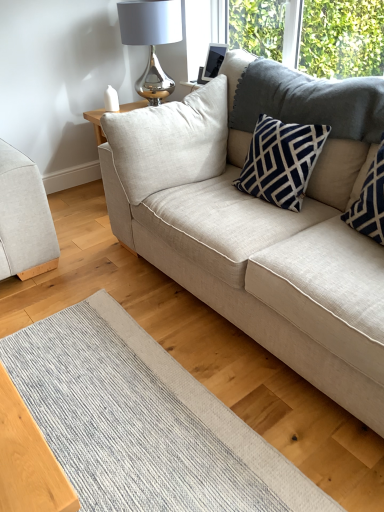
Identify the location of textured gray mat at lower center. The width and height of the screenshot is (384, 512). (143, 422).

At what (x,y) coordinates should I click in order to perform the action: click on navy blue textured pillow at upper right, placed as the 1th pillow when sorted from right to left. Please return your answer as a coordinate pair (x, y). The width and height of the screenshot is (384, 512). Looking at the image, I should click on (370, 201).

Locate an element on the screen. Image resolution: width=384 pixels, height=512 pixels. textured gray mat at lower center is located at coordinates (143, 422).

From the image's perspective, which is above, beige fabric couch at center, which is the 1th studio couch from right to left, or navy blue textured pillow at upper right, placed as the 1th pillow when sorted from right to left?

beige fabric couch at center, which is the 1th studio couch from right to left, appears higher in the image.

Is navy blue textured pillow at upper right, placed as the 1th pillow when sorted from right to left, at the back of beige fabric couch at center, acting as the 2th studio couch starting from the left?

Yes, beige fabric couch at center, acting as the 2th studio couch starting from the left,'s orientation is away from navy blue textured pillow at upper right, placed as the 1th pillow when sorted from right to left.

Consider the image. Which of these two, beige fabric couch at center, acting as the 2th studio couch starting from the left, or navy blue textured pillow at upper right, placed as the 1th pillow when sorted from right to left, is bigger?

beige fabric couch at center, acting as the 2th studio couch starting from the left.

How different are the orientations of beige fabric couch at center, which is the 1th studio couch from right to left, and navy blue textured pillow at upper right, placed as the 1th pillow when sorted from right to left, in degrees?

The facing directions of beige fabric couch at center, which is the 1th studio couch from right to left, and navy blue textured pillow at upper right, placed as the 1th pillow when sorted from right to left, are 0.00148 degrees apart.

Can you confirm if beige fabric couch at center, which is the 1th studio couch from right to left, is shorter than textured gray mat at lower center?

No.

In the scene shown: Is the position of beige fabric couch at center, acting as the 2th studio couch starting from the left, less distant than that of textured gray mat at lower center?

That is True.

Is beige fabric couch at center, acting as the 2th studio couch starting from the left, looking in the opposite direction of textured gray mat at lower center?

No, beige fabric couch at center, acting as the 2th studio couch starting from the left, is not facing away from textured gray mat at lower center.

Is navy blue textured pillow at upper right, marked as the second pillow in a right-to-left arrangement, at the left side of beige fabric couch at center, which is the 1th studio couch from right to left?

Correct, you'll find navy blue textured pillow at upper right, marked as the second pillow in a right-to-left arrangement, to the left of beige fabric couch at center, which is the 1th studio couch from right to left.

Who is smaller, navy blue textured pillow at upper right, marked as the second pillow in a right-to-left arrangement, or beige fabric couch at center, which is the 1th studio couch from right to left?

navy blue textured pillow at upper right, marked as the second pillow in a right-to-left arrangement.

From a real-world perspective, who is located higher, navy blue textured pillow at upper right, the first pillow when ordered from left to right, or beige fabric couch at center, which is the 1th studio couch from right to left?

From a 3D spatial view, navy blue textured pillow at upper right, the first pillow when ordered from left to right, is above.

Consider the image. Considering the relative sizes of navy blue textured pillow at upper right, the first pillow when ordered from left to right, and beige fabric couch at center, acting as the 2th studio couch starting from the left, in the image provided, is navy blue textured pillow at upper right, the first pillow when ordered from left to right, thinner than beige fabric couch at center, acting as the 2th studio couch starting from the left,?

Yes.

Which object is more forward, satin silver lamp at upper center or beige fabric couch at center, which is the 1th studio couch from right to left?

beige fabric couch at center, which is the 1th studio couch from right to left.

Based on the photo, between satin silver lamp at upper center and beige fabric couch at center, acting as the 2th studio couch starting from the left, which one has more height?

With more height is beige fabric couch at center, acting as the 2th studio couch starting from the left.

Considering the points (118, 8) and (379, 284), which point is in front, point (118, 8) or point (379, 284)?

The point (379, 284) is closer to the camera.

Can we say satin silver lamp at upper center lies outside beige fabric couch at center, acting as the 2th studio couch starting from the left?

Yes, satin silver lamp at upper center is outside of beige fabric couch at center, acting as the 2th studio couch starting from the left.

From the image's perspective, is textured gray mat at lower center on top of navy blue textured pillow at upper right, positioned as the second pillow in left-to-right order?

No, from the image's perspective, textured gray mat at lower center is not on top of navy blue textured pillow at upper right, positioned as the second pillow in left-to-right order.

Looking at this image, measure the distance between textured gray mat at lower center and navy blue textured pillow at upper right, positioned as the second pillow in left-to-right order.

The distance of textured gray mat at lower center from navy blue textured pillow at upper right, positioned as the second pillow in left-to-right order, is 3.43 feet.

From a real-world perspective, which is physically below, textured gray mat at lower center or navy blue textured pillow at upper right, placed as the 1th pillow when sorted from right to left?

textured gray mat at lower center.

Does point (182, 437) come behind point (363, 194)?

That is False.

Is navy blue textured pillow at upper right, positioned as the second pillow in left-to-right order, positioned beyond the bounds of beige fabric couch at left, which is the 2th studio couch in right-to-left order?

Yes, navy blue textured pillow at upper right, positioned as the second pillow in left-to-right order, is outside of beige fabric couch at left, which is the 2th studio couch in right-to-left order.

Are navy blue textured pillow at upper right, placed as the 1th pillow when sorted from right to left, and beige fabric couch at left, which is the 2th studio couch in right-to-left order, far apart?

navy blue textured pillow at upper right, placed as the 1th pillow when sorted from right to left, is far away from beige fabric couch at left, which is the 2th studio couch in right-to-left order.

Can you confirm if navy blue textured pillow at upper right, placed as the 1th pillow when sorted from right to left, is positioned to the left of beige fabric couch at left, which is counted as the first studio couch, starting from the left?

No, navy blue textured pillow at upper right, placed as the 1th pillow when sorted from right to left, is not to the left of beige fabric couch at left, which is counted as the first studio couch, starting from the left.

Image resolution: width=384 pixels, height=512 pixels. I want to click on the 2nd studio couch to the left when counting from the navy blue textured pillow at upper right, placed as the 1th pillow when sorted from right to left, so click(24, 218).

Image resolution: width=384 pixels, height=512 pixels. Find the location of `studio couch on the left of beige fabric couch at center, which is the 1th studio couch from right to left`. studio couch on the left of beige fabric couch at center, which is the 1th studio couch from right to left is located at coordinates (24, 218).

Is beige fabric couch at left, which is counted as the first studio couch, starting from the left, turned away from beige fabric couch at center, acting as the 2th studio couch starting from the left?

No.

Considering the relative positions of beige fabric couch at left, which is counted as the first studio couch, starting from the left, and beige fabric couch at center, acting as the 2th studio couch starting from the left, in the image provided, is beige fabric couch at left, which is counted as the first studio couch, starting from the left, to the left of beige fabric couch at center, acting as the 2th studio couch starting from the left, from the viewer's perspective?

Indeed, beige fabric couch at left, which is counted as the first studio couch, starting from the left, is positioned on the left side of beige fabric couch at center, acting as the 2th studio couch starting from the left.

Which of these two, beige fabric couch at left, which is counted as the first studio couch, starting from the left, or beige fabric couch at center, which is the 1th studio couch from right to left, stands taller?

beige fabric couch at center, which is the 1th studio couch from right to left, is taller.

From the beige fabric couch at center, acting as the 2th studio couch starting from the left, count 1st pillows backward and point to it. Please provide its 2D coordinates.

[(370, 201)]

I want to click on studio couch to the right of textured gray mat at lower center, so click(x=254, y=240).

Estimate the real-world distances between objects in this image. Which object is further from textured gray mat at lower center, beige fabric couch at left, which is the 2th studio couch in right-to-left order, or satin silver lamp at upper center?

satin silver lamp at upper center lies further to textured gray mat at lower center than the other object.

Looking at the image, which one is located further to navy blue textured pillow at upper right, placed as the 1th pillow when sorted from right to left, textured gray mat at lower center or satin silver lamp at upper center?

Based on the image, satin silver lamp at upper center appears to be further to navy blue textured pillow at upper right, placed as the 1th pillow when sorted from right to left.

Looking at the image, which one is located closer to satin silver lamp at upper center, textured gray mat at lower center or navy blue textured pillow at upper right, placed as the 1th pillow when sorted from right to left?

navy blue textured pillow at upper right, placed as the 1th pillow when sorted from right to left, is closer to satin silver lamp at upper center.

Considering their positions, is navy blue textured pillow at upper right, positioned as the second pillow in left-to-right order, positioned closer to beige fabric couch at center, which is the 1th studio couch from right to left, than textured gray mat at lower center?

Based on the image, navy blue textured pillow at upper right, positioned as the second pillow in left-to-right order, appears to be nearer to beige fabric couch at center, which is the 1th studio couch from right to left.

Considering their positions, is navy blue textured pillow at upper right, positioned as the second pillow in left-to-right order, positioned further to textured gray mat at lower center than beige fabric couch at left, which is the 2th studio couch in right-to-left order?

Based on the image, navy blue textured pillow at upper right, positioned as the second pillow in left-to-right order, appears to be further to textured gray mat at lower center.

Looking at the image, which one is located closer to navy blue textured pillow at upper right, positioned as the second pillow in left-to-right order, satin silver lamp at upper center or textured gray mat at lower center?

textured gray mat at lower center is positioned closer to the anchor navy blue textured pillow at upper right, positioned as the second pillow in left-to-right order.

When comparing their distances from beige fabric couch at center, acting as the 2th studio couch starting from the left, does textured gray mat at lower center or navy blue textured pillow at upper right, placed as the 1th pillow when sorted from right to left, seem further?

textured gray mat at lower center is further to beige fabric couch at center, acting as the 2th studio couch starting from the left.

Considering their positions, is navy blue textured pillow at upper right, positioned as the second pillow in left-to-right order, positioned closer to textured gray mat at lower center than satin silver lamp at upper center?

Based on the image, navy blue textured pillow at upper right, positioned as the second pillow in left-to-right order, appears to be nearer to textured gray mat at lower center.

The image size is (384, 512). I want to click on mat between beige fabric couch at left, which is the 2th studio couch in right-to-left order, and beige fabric couch at center, acting as the 2th studio couch starting from the left, from left to right, so click(x=143, y=422).

Identify the location of studio couch located between beige fabric couch at center, acting as the 2th studio couch starting from the left, and satin silver lamp at upper center in the depth direction. This screenshot has height=512, width=384. (24, 218).

This screenshot has height=512, width=384. I want to click on studio couch located between beige fabric couch at left, which is counted as the first studio couch, starting from the left, and navy blue textured pillow at upper right, placed as the 1th pillow when sorted from right to left, in the left-right direction, so click(x=254, y=240).

The height and width of the screenshot is (512, 384). In order to click on mat situated between beige fabric couch at left, which is counted as the first studio couch, starting from the left, and navy blue textured pillow at upper right, the first pillow when ordered from left to right, from left to right in this screenshot , I will do `click(143, 422)`.